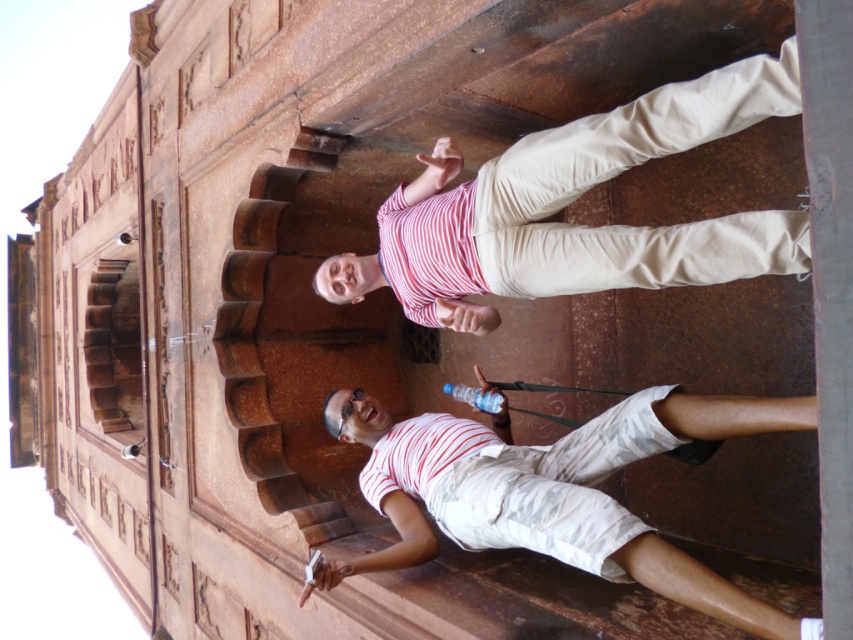
Can you confirm if striped cotton shirt at center is taller than white cotton shorts at lower right?

Incorrect, striped cotton shirt at center's height is not larger of white cotton shorts at lower right's.

Is striped cotton shirt at center to the left of white cotton shorts at lower right from the viewer's perspective?

Incorrect, striped cotton shirt at center is not on the left side of white cotton shorts at lower right.

Which is in front, point (374, 285) or point (555, 467)?

Point (555, 467) is more forward.

Locate an element on the screen. The width and height of the screenshot is (853, 640). striped cotton shirt at center is located at coordinates (572, 200).